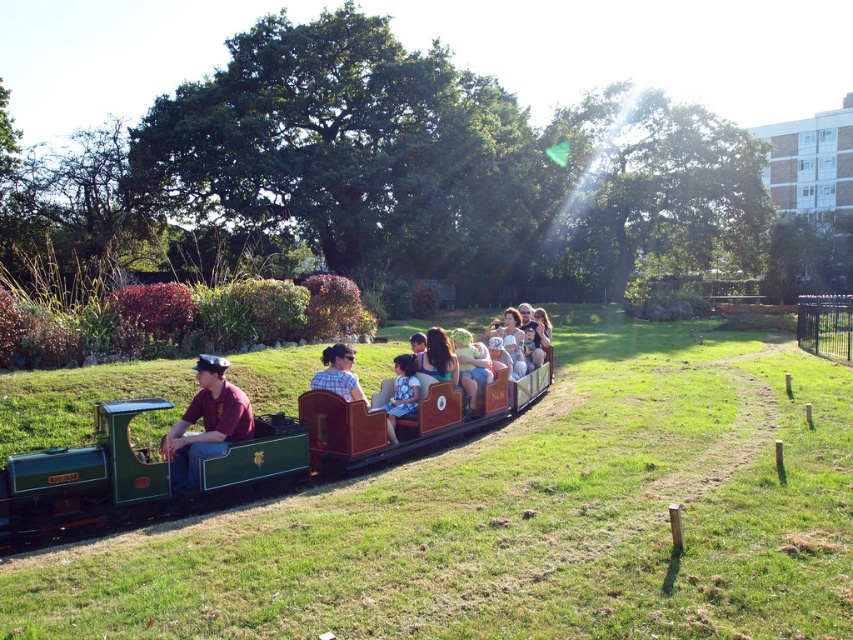
Between matte maroon shirt at center and plaid shirt at center, which one has less height?

Standing shorter between the two is plaid shirt at center.

Which is more to the left, matte maroon shirt at center or plaid shirt at center?

matte maroon shirt at center

Identify the location of matte maroon shirt at center. This screenshot has width=853, height=640. (206, 422).

Identify the location of matte maroon shirt at center. (206, 422).

Is matte blue dress at center to the right of plaid shirt at center from the viewer's perspective?

Indeed, matte blue dress at center is positioned on the right side of plaid shirt at center.

Is point (469, 355) positioned behind point (331, 364)?

Yes, point (469, 355) is behind point (331, 364).

Where is `matte blue dress at center`? This screenshot has height=640, width=853. matte blue dress at center is located at coordinates (471, 365).

Which is below, matte maroon shirt at center or blue floral dress at center?

matte maroon shirt at center is lower down.

Who is more distant from viewer, (195,413) or (405,390)?

The point (405,390) is behind.

Does point (224, 429) lie behind point (393, 404)?

No, (224, 429) is in front of (393, 404).

The image size is (853, 640). What are the coordinates of `matte maroon shirt at center` in the screenshot? It's located at (206, 422).